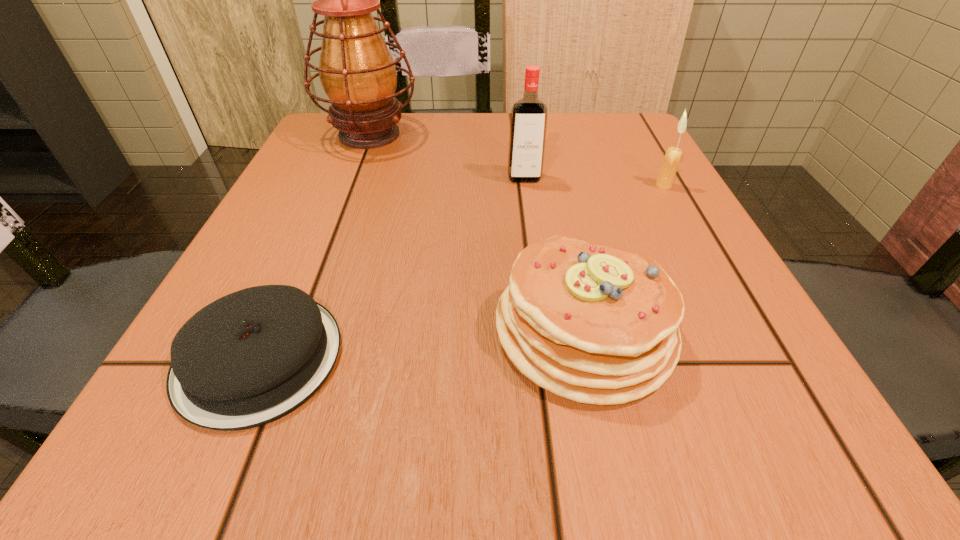
Where is `free location that satisfies the following two spatial constraints: 1. on the back side of the fourth tallest object; 2. on the right side of the candle`? free location that satisfies the following two spatial constraints: 1. on the back side of the fourth tallest object; 2. on the right side of the candle is located at coordinates (553, 185).